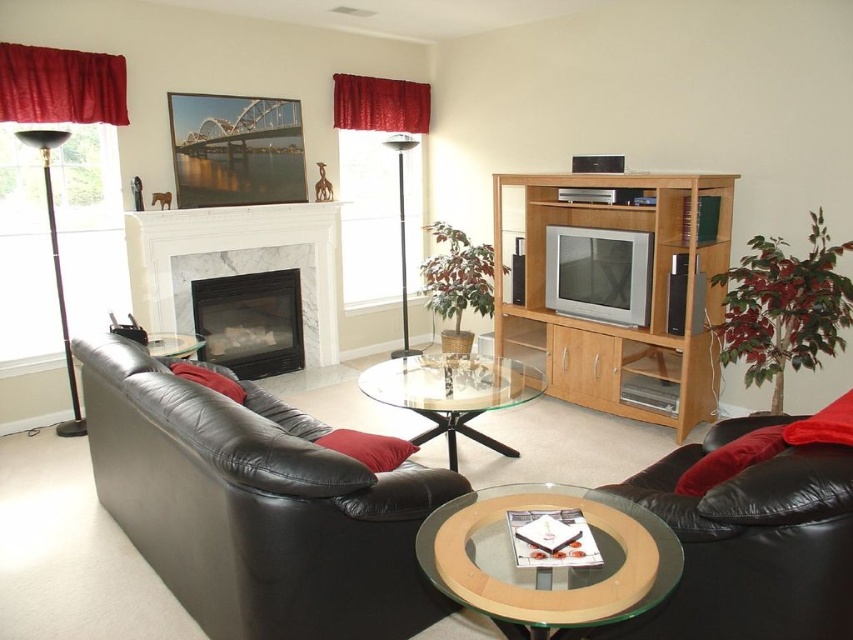
Which of these two, black leather couch at lower right or white marble fireplace at center, stands shorter?

With less height is black leather couch at lower right.

Who is positioned more to the left, black leather couch at lower right or white marble fireplace at center?

white marble fireplace at center

Is point (728, 611) positioned behind point (323, 244)?

No, (728, 611) is closer to viewer.

Identify the location of black leather couch at lower right. The image size is (853, 640). (752, 544).

Which of these two, black leather couch at lower left or white marble fireplace at center, stands taller?

white marble fireplace at center

Which is in front, point (318, 625) or point (308, 324)?

Positioned in front is point (318, 625).

Identify the location of black leather couch at lower left. Image resolution: width=853 pixels, height=640 pixels. (254, 506).

Is white marble fireplace at center wider than velvet red curtain at upper center?

Yes, white marble fireplace at center is wider than velvet red curtain at upper center.

Does white marble fireplace at center appear on the right side of velvet red curtain at upper center?

No, white marble fireplace at center is not to the right of velvet red curtain at upper center.

The image size is (853, 640). I want to click on white marble fireplace at center, so (236, 262).